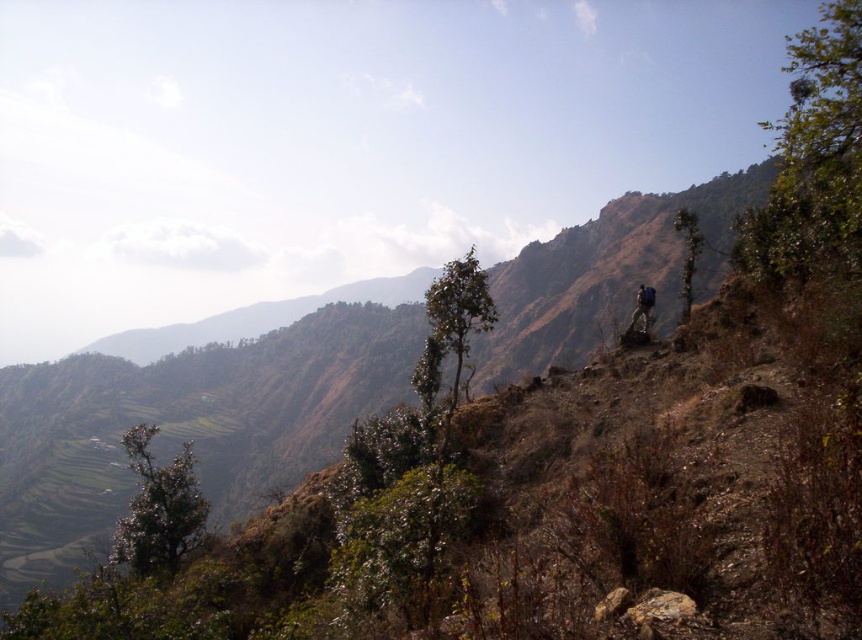
You are a hiker navigating the rocky path in this mountainous landscape. You notice a point marked at coordinates (688, 256). What object is located at this point?

The point at coordinates (688, 256) indicates a green leafy tree at upper right.

You are a hiker planning to take a photo of both the green leafy tree at lower left and the green leafy tree at upper right in the mountainous landscape. Considering their sizes, which tree would you position closer to the camera to ensure both fit in the frame?

The green leafy tree at lower left is wider than the green leafy tree at upper right. To ensure both fit in the frame, position the wider green leafy tree at lower left closer to the camera so its larger size doesn

You are a hiker trying to navigate the rocky path. You see two green leafy trees in the scene. Which one is closer to you, the green leafy tree at lower left or the green leafy tree at upper right?

The green leafy tree at lower left is closer to the viewer than the green leafy tree at upper right.